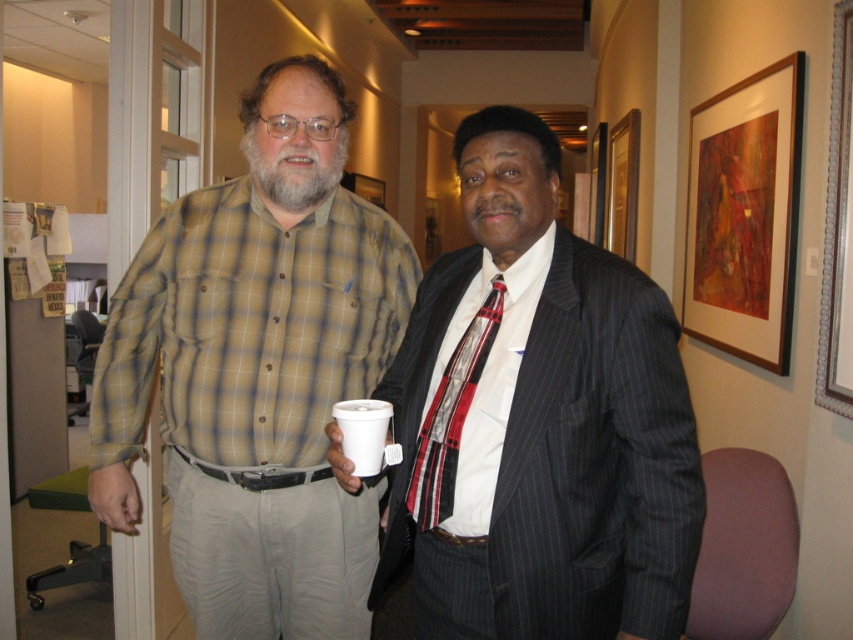
You are standing in a professional setting and want to place a new plant pot exactly at point (483, 129). If your arm reaches 1 meter, can you reach that point?

The distance of point (483, 129) from viewer is 1.26 meters, so no, you cannot reach that point since it is further away than your arm length of 1 meter.

Based on the photo, you are organizing a photoshoot and need to arrange the striped suit at center and the red plaid tie at center according to their positions in the image. Which item should be placed to the left in the setup?

The red plaid tie at center should be placed to the left because the striped suit at center is positioned to its right in the image.

You are a photographer standing in the same room. You want to take a photo of the striped suit at center and the wooden picture frame at upper right in the same shot. The camera you are using has a maximum focus range of 3 meters. Will both subjects be in focus?

The striped suit at center is 2.88 meters from wooden picture frame at upper right. Since the distance between them is within the camera maximum focus range of 3 meters, both subjects will be in focus.